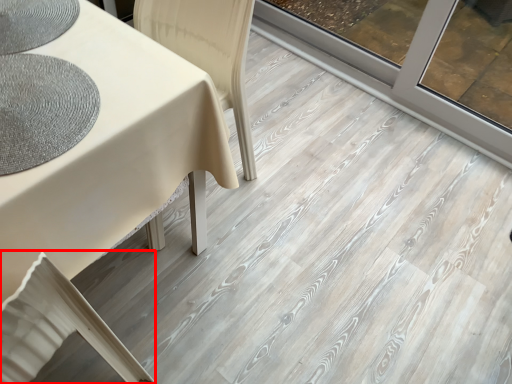
Question: Where is swivel chair (annotated by the red box) located in relation to mat in the image?

Choices:
 (A) right
 (B) left

Answer: (B)